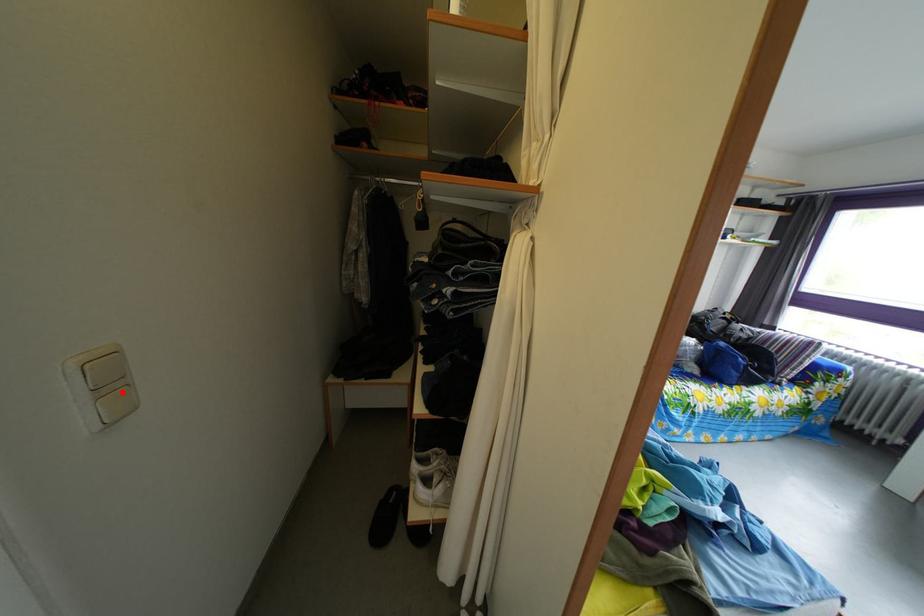
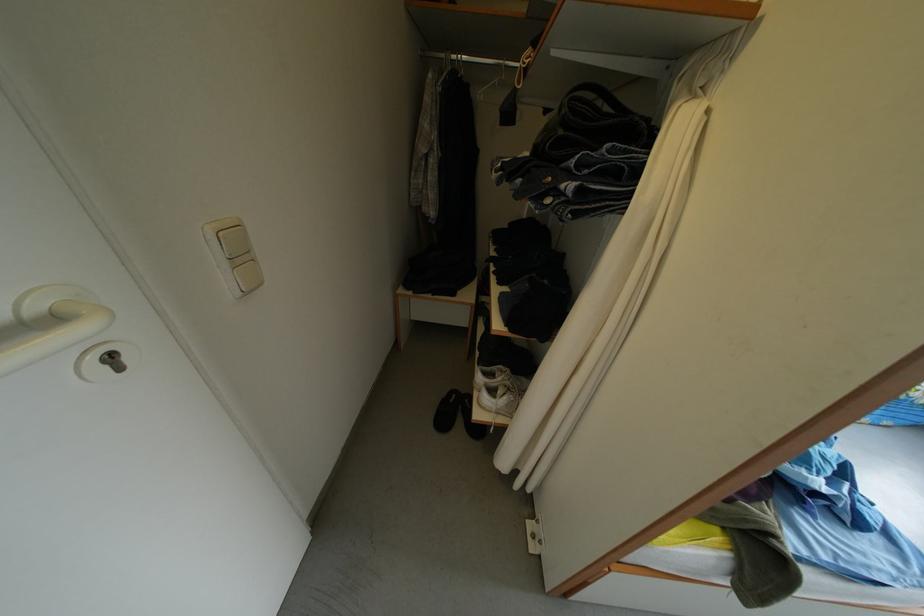
Find the pixel in the second image that matches the highlighted location in the first image.

(251, 265)